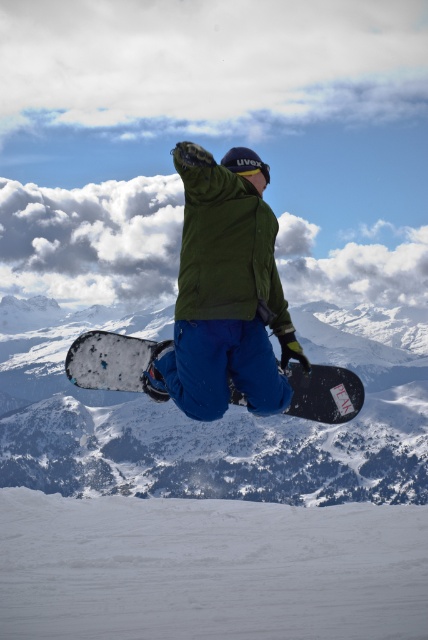
You are a photographer trying to capture the snowboarder. You notice the green matte jacket at center and the black matte snowboard at center. Which object appears larger in the photo?

The green matte jacket at center appears larger because it is closer to the viewer than the black matte snowboard at center.

You are an observer watching the snowboarder. Which object, the white matte snowboard at center or the green matte jacket at center, appears larger in the image?

The white matte snowboard at center appears larger because it is much taller than the green matte jacket at center.